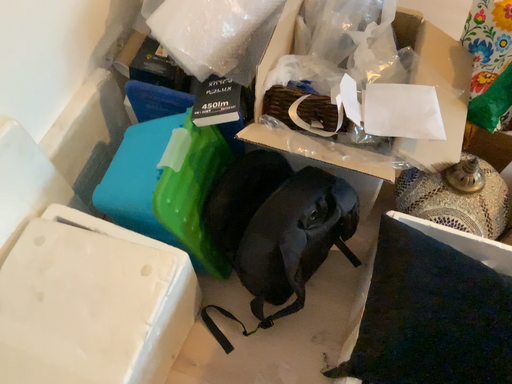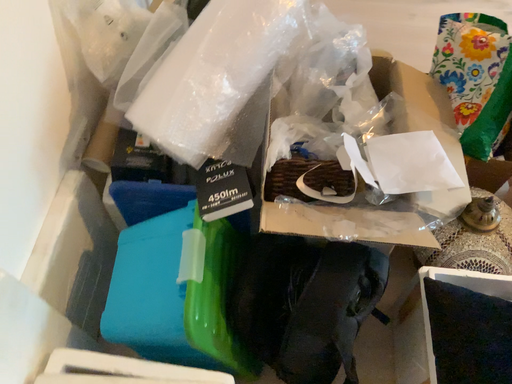
Question: How did the camera likely rotate when shooting the video?

Choices:
 (A) rotated left
 (B) rotated right

Answer: (B)